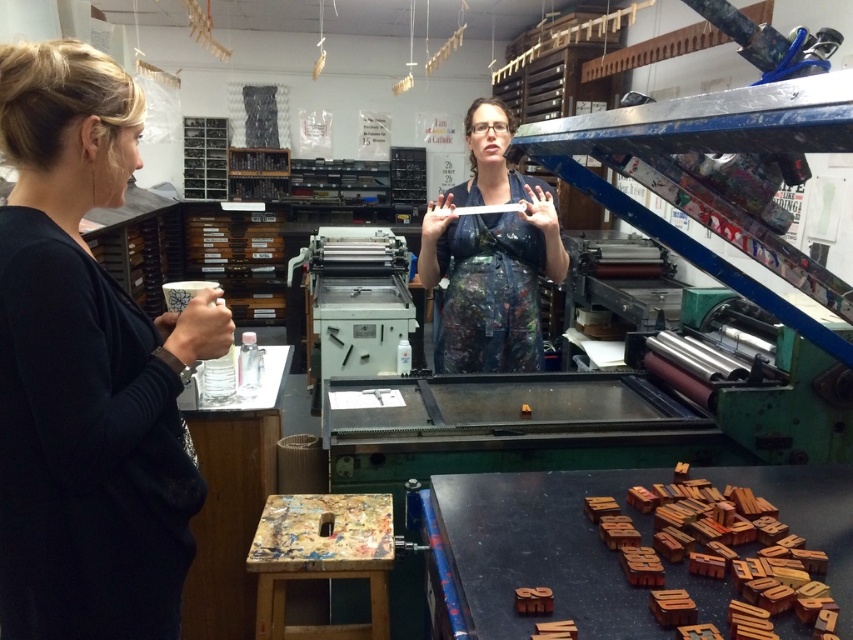
You are an assistant in the printmaking studio. You need to hand a tool to the person wearing the black fabric shirt at left and the person wearing the matte black apron at center. Which person should you approach first to ensure the tool reaches both without needing to move around obstacles?

You should first give the tool to the matte black apron at center because the black fabric shirt at left is in front of them, so reaching the apron person first allows the tool to be passed efficiently without needing to go around the shirt person.

You are an assistant in the printmaking studio and need to locate the black fabric shirt at left and the matte black apron at center. Which object is lower in the image?

The black fabric shirt at left is positioned under the matte black apron at center, so it is lower in the image.

You are an observer in the studio and notice two items, the black fabric shirt at left and the matte black apron at center. Which item is located to the left of the other?

The black fabric shirt at left is positioned on the left side of the matte black apron at center.